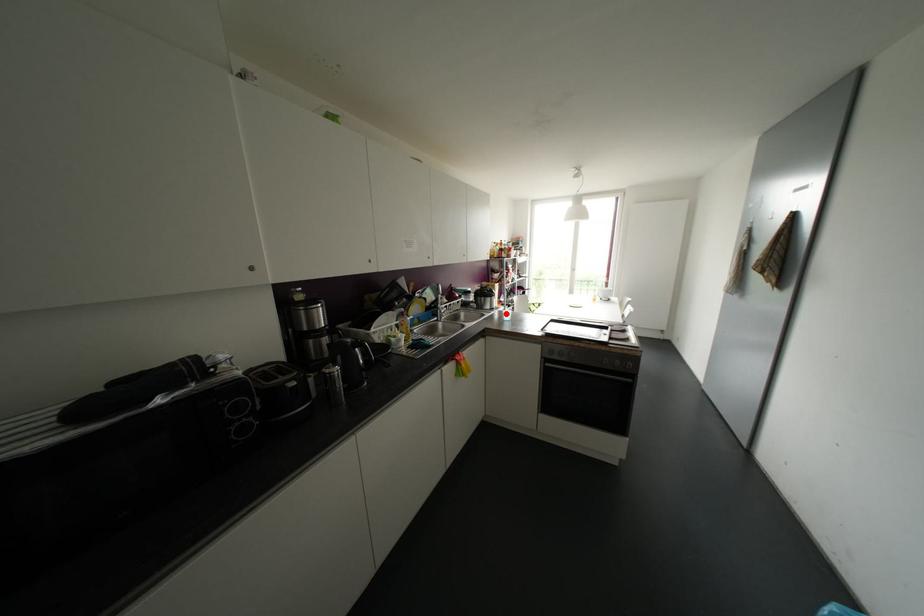
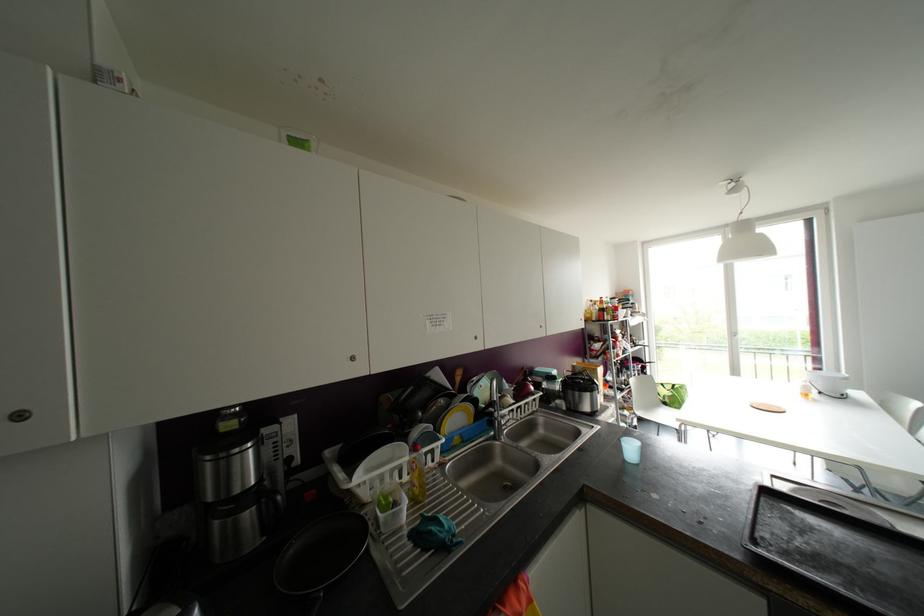
In the second image, find the point that corresponds to the highlighted location in the first image.

(629, 448)